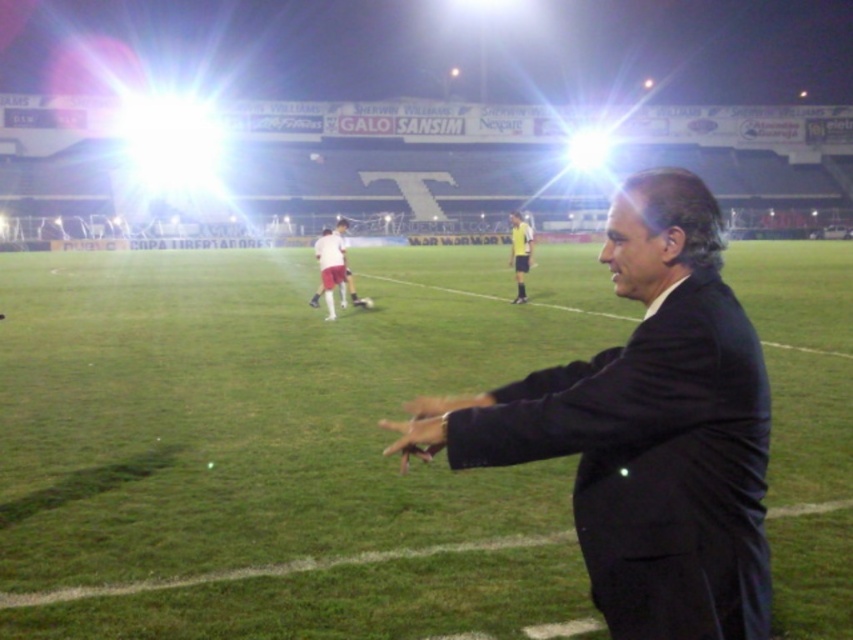
Question: Is green grass at center behind black suit at right?

Choices:
 (A) no
 (B) yes

Answer: (B)

Question: Which object appears closest to the camera in this image?

Choices:
 (A) black suit at right
 (B) green grass at center

Answer: (A)

Question: Does green grass at center appear under black suit at right?

Choices:
 (A) no
 (B) yes

Answer: (A)

Question: Is green grass at center to the left of black suit at right from the viewer's perspective?

Choices:
 (A) yes
 (B) no

Answer: (B)

Question: Which point is farther to the camera?

Choices:
 (A) (345, 570)
 (B) (634, 189)

Answer: (A)